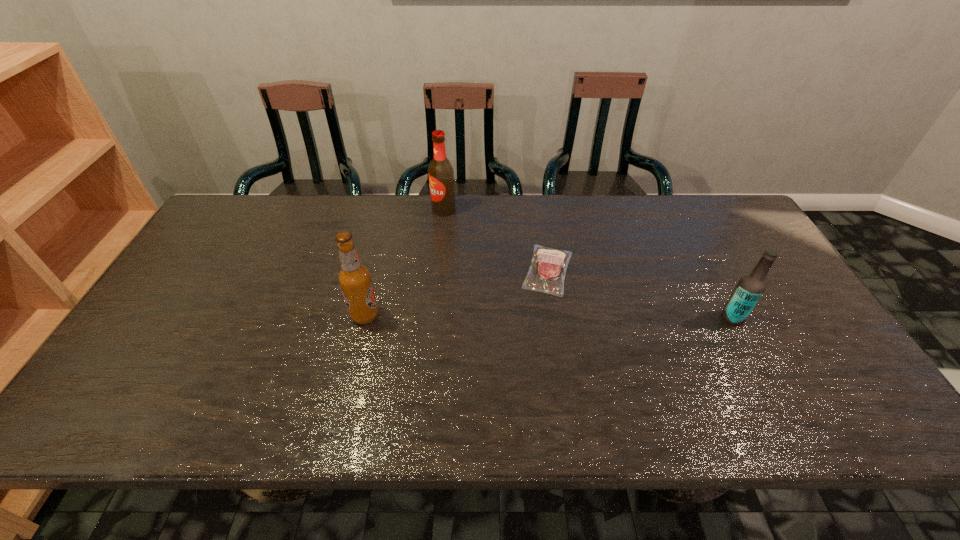
The height and width of the screenshot is (540, 960). What are the coordinates of `vacant region at the near right corner of the desktop` in the screenshot? It's located at (841, 426).

Identify the location of free area in between the third nearest object and the leftmost object. Image resolution: width=960 pixels, height=540 pixels. (456, 293).

Image resolution: width=960 pixels, height=540 pixels. What are the coordinates of `unoccupied position between the third object from left to right and the shortest beer bottle` in the screenshot? It's located at (640, 294).

Where is `free spot between the farthest beer bottle and the second shortest object`? free spot between the farthest beer bottle and the second shortest object is located at coordinates (588, 264).

This screenshot has width=960, height=540. Find the location of `vacant space in between the steak and the farthest object`. vacant space in between the steak and the farthest object is located at coordinates [x=495, y=240].

I want to click on free space that is in between the second farthest object and the leftmost object, so click(456, 293).

Locate an element on the screen. Image resolution: width=960 pixels, height=540 pixels. vacant region between the second beer bottle from left to right and the leftmost object is located at coordinates (404, 262).

Locate an element on the screen. This screenshot has width=960, height=540. vacant area that lies between the leftmost object and the rightmost object is located at coordinates (549, 316).

The width and height of the screenshot is (960, 540). I want to click on vacant area that lies between the shortest beer bottle and the farthest object, so click(x=588, y=264).

The height and width of the screenshot is (540, 960). I want to click on free space between the steak and the leftmost beer bottle, so click(x=456, y=293).